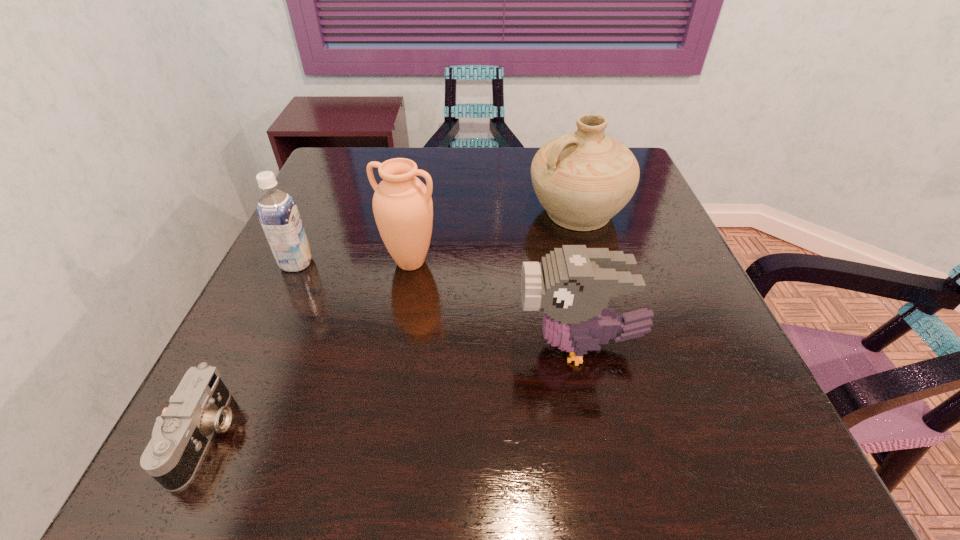
At what (x,y) coordinates should I click in order to perform the action: click on free space between the fourth farthest object and the soya milk. Please return your answer as a coordinate pair (x, y). Looking at the image, I should click on (438, 305).

Locate which object ranks in proximity to the bird. Please provide its 2D coordinates. Your answer should be formatted as a tuple, i.e. [(x, y)], where the tuple contains the x and y coordinates of a point satisfying the conditions above.

[(402, 205)]

This screenshot has width=960, height=540. Find the location of `the fourth closest object to the third object from right to left`. the fourth closest object to the third object from right to left is located at coordinates (180, 437).